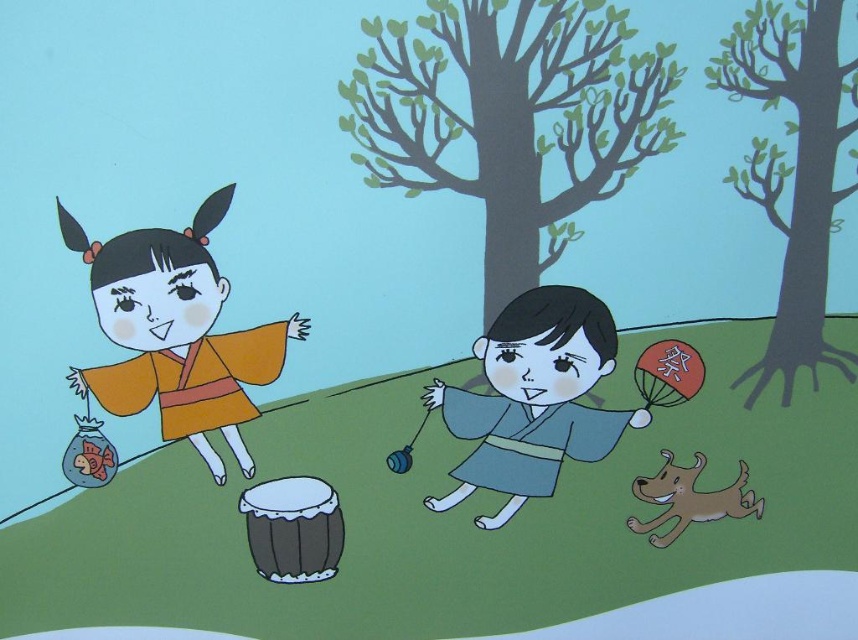
In the scene shown: Is orange matte kimono at left bigger than brown matte dog at lower right?

Yes.

Is point (139, 301) closer to camera compared to point (657, 481)?

Yes, point (139, 301) is in front of point (657, 481).

I want to click on orange matte kimono at left, so click(x=176, y=333).

Is the position of matte blue kimono at center more distant than that of brown matte dog at lower right?

No.

Who is more distant from viewer, (484, 408) or (681, 499)?

Positioned behind is point (681, 499).

The width and height of the screenshot is (858, 640). What are the coordinates of `matte blue kimono at center` in the screenshot? It's located at (533, 397).

Is point (210, 448) positioned before point (523, 440)?

Yes, point (210, 448) is in front of point (523, 440).

Does orange matte kimono at left appear under matte blue kimono at center?

No.

Is point (203, 348) behind point (571, 372)?

No, it is in front of (571, 372).

The width and height of the screenshot is (858, 640). I want to click on orange matte kimono at left, so click(x=176, y=333).